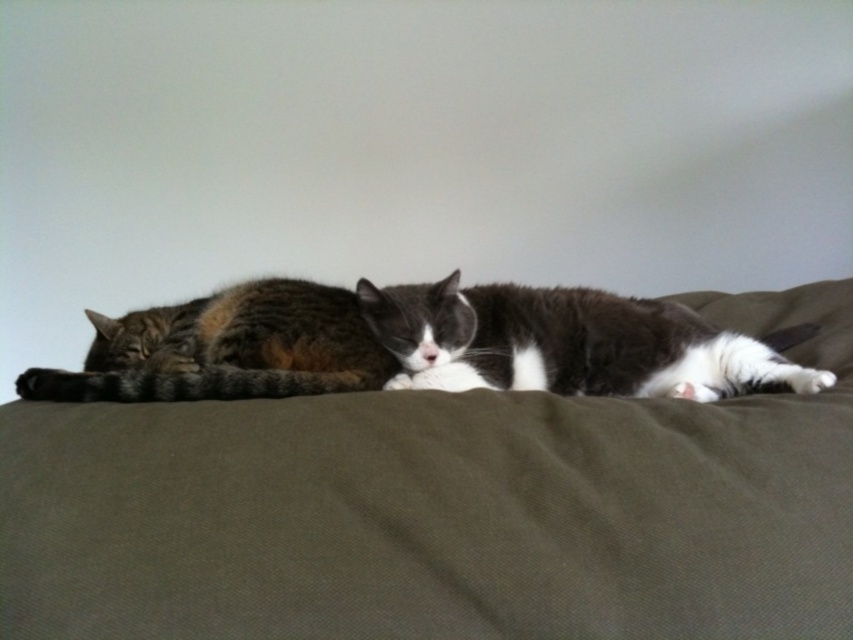
Describe the element at coordinates (567, 342) in the screenshot. The width and height of the screenshot is (853, 640). I see `white-gray fur cat at center` at that location.

Identify the location of white-gray fur cat at center. (567, 342).

In the scene shown: Can you confirm if olive green fabric couch at center is positioned to the right of white-gray fur cat at center?

Incorrect, olive green fabric couch at center is not on the right side of white-gray fur cat at center.

Who is shorter, olive green fabric couch at center or white-gray fur cat at center?

With less height is white-gray fur cat at center.

Is point (585, 570) farther from camera compared to point (537, 323)?

No, (585, 570) is in front of (537, 323).

Where is `olive green fabric couch at center`? olive green fabric couch at center is located at coordinates (442, 509).

Does olive green fabric couch at center have a greater height compared to tabby fur cat at left?

Correct, olive green fabric couch at center is much taller as tabby fur cat at left.

From the picture: Who is positioned more to the left, olive green fabric couch at center or tabby fur cat at left?

tabby fur cat at left is more to the left.

Does point (415, 477) come farther from viewer compared to point (218, 326)?

No.

Locate an element on the screen. olive green fabric couch at center is located at coordinates (442, 509).